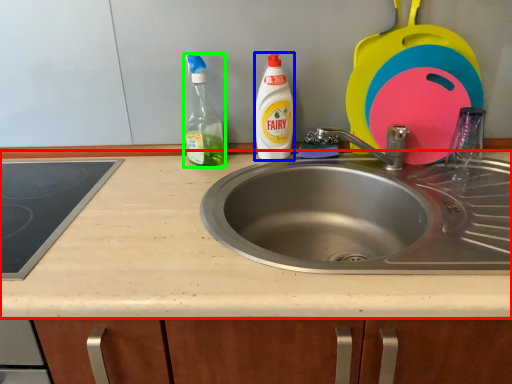
Question: Which object is the closest to the countertop (highlighted by a red box)? Choose among these: cleaning product (highlighted by a blue box) or cleaning product (highlighted by a green box).

Choices:
 (A) cleaning product
 (B) cleaning product

Answer: (B)